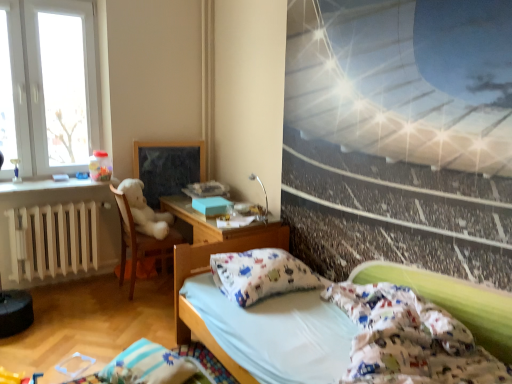
In order to face matte black picture frame at center, should I rotate leftwards or rightwards?

Rotate your view left by about 11.193°.

The width and height of the screenshot is (512, 384). What do you see at coordinates (167, 167) in the screenshot? I see `matte black picture frame at center` at bounding box center [167, 167].

This screenshot has height=384, width=512. Describe the element at coordinates (260, 274) in the screenshot. I see `white cotton pillow at center, marked as the second pillow in a left-to-right arrangement` at that location.

This screenshot has height=384, width=512. I want to click on white cotton pillow at center, marked as the second pillow in a left-to-right arrangement, so click(260, 274).

What is the approximate width of white plush at left?

It is 20.95 inches.

Describe the element at coordinates (48, 86) in the screenshot. I see `white glass window at upper left` at that location.

The image size is (512, 384). I want to click on white matte radiator at left, so click(x=53, y=240).

This screenshot has height=384, width=512. In order to click on chair above the blue striped pillow at lower left, acting as the 1th pillow starting from the bottom (from a real-world perspective) in this screenshot , I will do `click(140, 241)`.

Considering the relative positions of blue striped pillow at lower left, placed as the second pillow when sorted from top to bottom, and white plush at left in the image provided, is blue striped pillow at lower left, placed as the second pillow when sorted from top to bottom, behind white plush at left?

No, it is not.

Is blue striped pillow at lower left, acting as the 1th pillow starting from the bottom, oriented towards white plush at left?

No, blue striped pillow at lower left, acting as the 1th pillow starting from the bottom, is not turned towards white plush at left.

Is the position of white cotton pillow at center, the 1th pillow in the right-to-left sequence, less distant than that of matte black picture frame at center?

Yes, white cotton pillow at center, the 1th pillow in the right-to-left sequence, is closer to the camera.

Considering the positions of objects white cotton pillow at center, the 1th pillow in the right-to-left sequence, and matte black picture frame at center in the image provided, who is more to the right, white cotton pillow at center, the 1th pillow in the right-to-left sequence, or matte black picture frame at center?

Positioned to the right is white cotton pillow at center, the 1th pillow in the right-to-left sequence.

Considering the sizes of objects white cotton pillow at center, the 1th pillow in the right-to-left sequence, and matte black picture frame at center in the image provided, who is thinner, white cotton pillow at center, the 1th pillow in the right-to-left sequence, or matte black picture frame at center?

Thinner between the two is matte black picture frame at center.

Who is smaller, white cotton pillow at center, marked as the second pillow in a bottom-to-top arrangement, or matte black picture frame at center?

matte black picture frame at center is smaller.

From the image's perspective, is white plush at left above or below blue striped pillow at lower left, acting as the 1th pillow starting from the bottom?

Based on their image positions, white plush at left is located above blue striped pillow at lower left, acting as the 1th pillow starting from the bottom.

Between white plush at left and blue striped pillow at lower left, the 2th pillow in the right-to-left sequence, which one appears on the right side from the viewer's perspective?

blue striped pillow at lower left, the 2th pillow in the right-to-left sequence.

In the scene shown: Can you tell me how much white plush at left and blue striped pillow at lower left, the 2th pillow in the right-to-left sequence, differ in facing direction?

They differ by 157 degrees in their facing directions.

From the image's perspective, who appears lower, white plush at left or matte black picture frame at center?

white plush at left is shown below in the image.

Is white plush at left smaller than matte black picture frame at center?

No.

Is white plush at left facing away from matte black picture frame at center?

No, matte black picture frame at center is not at the back of white plush at left.

Is white matte radiator at left facing away from white cotton pillow at center, which is the 1th pillow from top to bottom?

white matte radiator at left does not have its back to white cotton pillow at center, which is the 1th pillow from top to bottom.

Could you measure the distance between white matte radiator at left and white cotton pillow at center, marked as the second pillow in a left-to-right arrangement?

white matte radiator at left is 5.10 feet from white cotton pillow at center, marked as the second pillow in a left-to-right arrangement.

From the image's perspective, is white matte radiator at left above or below white cotton pillow at center, marked as the second pillow in a left-to-right arrangement?

Based on their image positions, white matte radiator at left is located above white cotton pillow at center, marked as the second pillow in a left-to-right arrangement.

Between white matte radiator at left and white cotton pillow at center, marked as the second pillow in a left-to-right arrangement, which one has smaller width?

white matte radiator at left.

The height and width of the screenshot is (384, 512). I want to click on pillow that appears above the white cotton bed at lower right (from a real-world perspective), so click(260, 274).

Is white cotton bed at lower right a part of white cotton pillow at center, marked as the second pillow in a left-to-right arrangement?

No, white cotton bed at lower right is not a part of white cotton pillow at center, marked as the second pillow in a left-to-right arrangement.

Considering the sizes of objects white cotton pillow at center, marked as the second pillow in a bottom-to-top arrangement, and white cotton bed at lower right in the image provided, who is thinner, white cotton pillow at center, marked as the second pillow in a bottom-to-top arrangement, or white cotton bed at lower right?

white cotton pillow at center, marked as the second pillow in a bottom-to-top arrangement.

From a real-world perspective, is white cotton pillow at center, marked as the second pillow in a bottom-to-top arrangement, on top of white cotton bed at lower right?

Yes, from a real-world perspective, white cotton pillow at center, marked as the second pillow in a bottom-to-top arrangement, is on top of white cotton bed at lower right.

Locate an element on the screen. Image resolution: width=512 pixels, height=384 pixels. bed on the right of white matte radiator at left is located at coordinates (259, 321).

Are white cotton bed at lower right and white matte radiator at left far apart?

Absolutely, white cotton bed at lower right is distant from white matte radiator at left.

Who is bigger, white cotton bed at lower right or white matte radiator at left?

Bigger between the two is white cotton bed at lower right.

Can you confirm if white cotton bed at lower right is wider than white matte radiator at left?

Indeed, white cotton bed at lower right has a greater width compared to white matte radiator at left.

Where is `chair above the blue striped pillow at lower left, placed as the second pillow when sorted from top to bottom (from a real-world perspective)`? The height and width of the screenshot is (384, 512). chair above the blue striped pillow at lower left, placed as the second pillow when sorted from top to bottom (from a real-world perspective) is located at coordinates (140, 241).

What are the coordinates of `picture frame on the left of white cotton pillow at center, marked as the second pillow in a bottom-to-top arrangement` in the screenshot? It's located at (167, 167).

Considering their positions, is white plush at left positioned further to white glass window at upper left than white cotton pillow at center, marked as the second pillow in a left-to-right arrangement?

Among the two, white cotton pillow at center, marked as the second pillow in a left-to-right arrangement, is located further to white glass window at upper left.

When comparing their distances from matte black picture frame at center, does blue striped pillow at lower left, the 2th pillow in the right-to-left sequence, or white plush at left seem closer?

Among the two, white plush at left is located nearer to matte black picture frame at center.

Based on their spatial positions, is white glass window at upper left or white cotton pillow at center, the 1th pillow in the right-to-left sequence, further from white cotton bed at lower right?

white glass window at upper left lies further to white cotton bed at lower right than the other object.

Which object lies nearer to the anchor point white glass window at upper left, white cotton pillow at center, marked as the second pillow in a left-to-right arrangement, or white matte radiator at left?

white matte radiator at left is positioned closer to the anchor white glass window at upper left.

Based on their spatial positions, is white matte radiator at left or white cotton pillow at center, marked as the second pillow in a left-to-right arrangement, further from white glass window at upper left?

white cotton pillow at center, marked as the second pillow in a left-to-right arrangement, lies further to white glass window at upper left than the other object.

Considering their positions, is matte black picture frame at center positioned closer to white cotton bed at lower right than white plush at left?

The object closer to white cotton bed at lower right is white plush at left.

When comparing their distances from white matte radiator at left, does white plush at left or matte black picture frame at center seem closer?

white plush at left is closer to white matte radiator at left.

From the picture: When comparing their distances from white glass window at upper left, does matte black picture frame at center or white plush at left seem closer?

Based on the image, matte black picture frame at center appears to be nearer to white glass window at upper left.

This screenshot has width=512, height=384. What are the coordinates of `chair located between white matte radiator at left and matte black picture frame at center in the left-right direction` in the screenshot? It's located at 140,241.

This screenshot has height=384, width=512. What are the coordinates of `picture frame that lies between white glass window at upper left and white plush at left from top to bottom` in the screenshot? It's located at pyautogui.click(x=167, y=167).

Image resolution: width=512 pixels, height=384 pixels. I want to click on pillow between white cotton bed at lower right and white cotton pillow at center, marked as the second pillow in a bottom-to-top arrangement, in the front-back direction, so click(x=148, y=366).

The height and width of the screenshot is (384, 512). What are the coordinates of `pillow located between white matte radiator at left and white cotton pillow at center, which is the 1th pillow from top to bottom, in the left-right direction` in the screenshot? It's located at (148, 366).